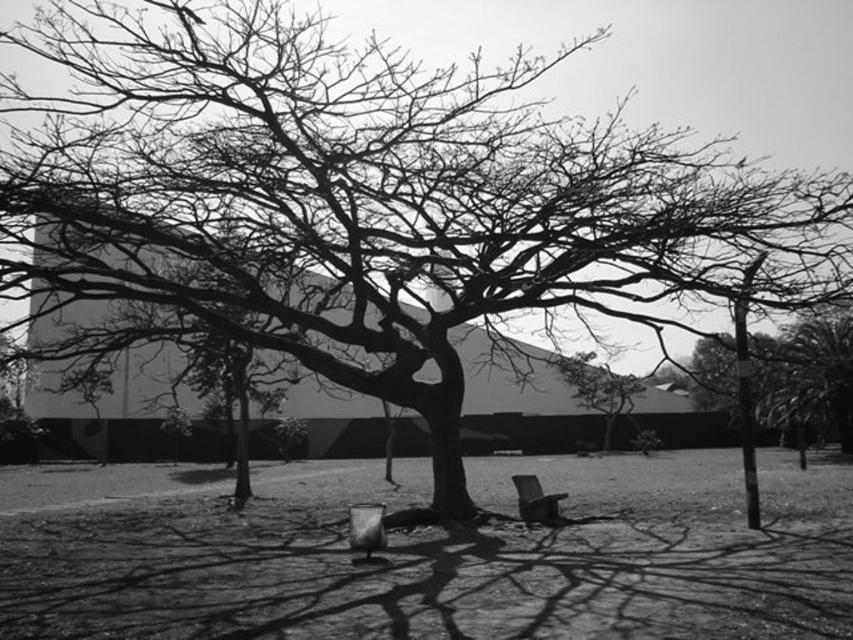
You are planning to take a photo of the smooth bark tree at center and the metallic silver chair at center from a distance. Which object will appear taller in your photo?

The smooth bark tree at center will appear taller in the photo because it has a greater height compared to the metallic silver chair at center.